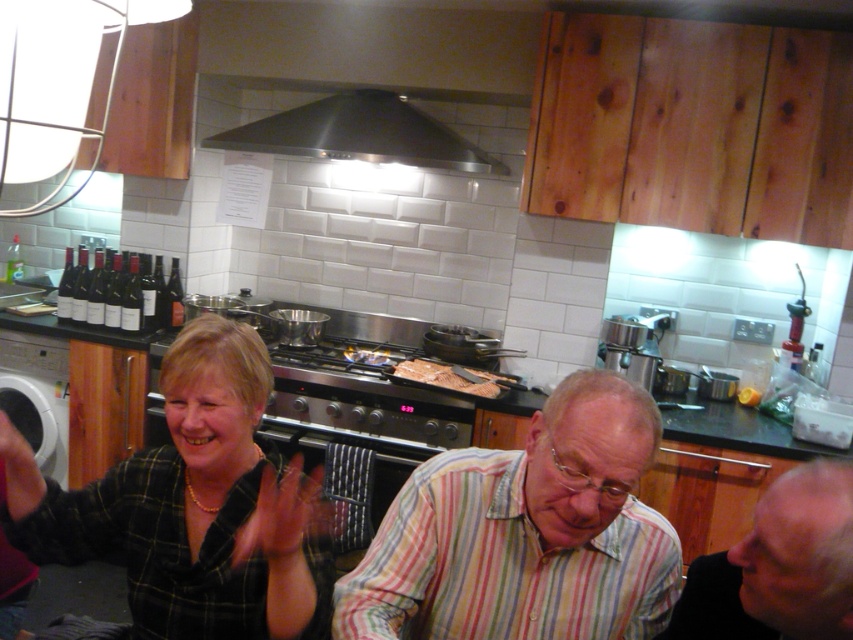
Question: Estimate the real-world distances between objects in this image. Which object is farther from the brown matte meat at center?

Choices:
 (A) white glossy dishwasher at left
 (B) striped cotton shirt at lower right
 (C) matte black bottles at left
 (D) black plaid shirt at center

Answer: (B)

Question: Which point is closer to the camera?

Choices:
 (A) brown matte meat at center
 (B) striped cotton shirt at center
 (C) black plaid shirt at center

Answer: (C)

Question: Which point is closer to the camera?

Choices:
 (A) striped cotton shirt at lower right
 (B) white glossy dishwasher at left
 (C) brown matte meat at center
 (D) matte black bottles at left

Answer: (A)

Question: Does striped cotton shirt at center appear over striped cotton shirt at lower right?

Choices:
 (A) no
 (B) yes

Answer: (A)

Question: Observing the image, what is the correct spatial positioning of matte black bottles at left in reference to brown matte meat at center?

Choices:
 (A) right
 (B) left

Answer: (B)

Question: Is striped cotton shirt at lower right behind stainless steel exhaust hood at upper center?

Choices:
 (A) no
 (B) yes

Answer: (A)